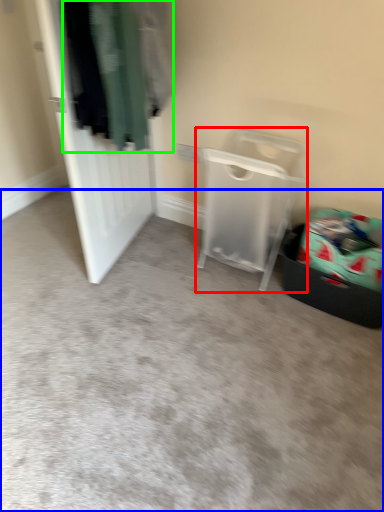
Question: Which is nearer to the furniture (highlighted by a red box)? plain (highlighted by a blue box) or clothing (highlighted by a green box).

Choices:
 (A) plain
 (B) clothing

Answer: (A)